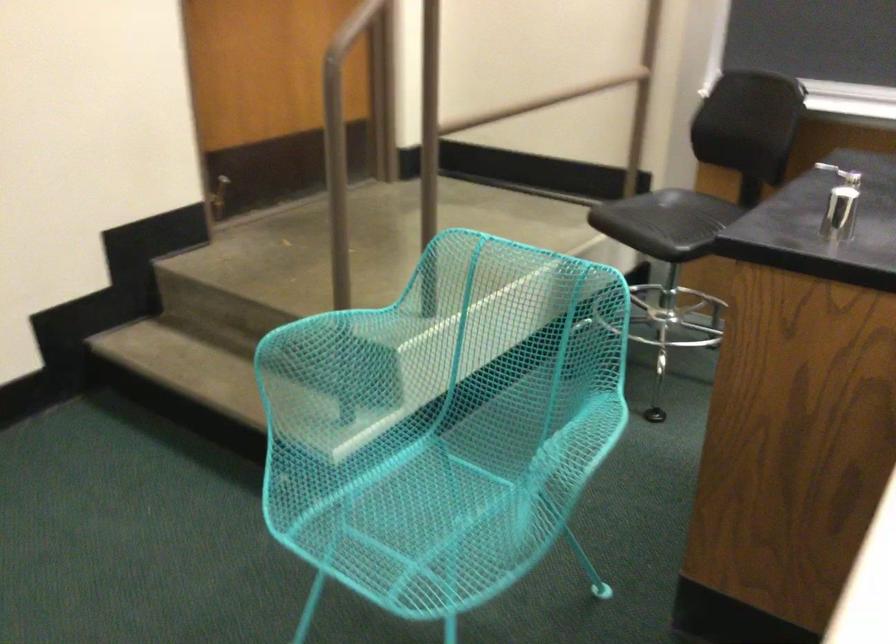
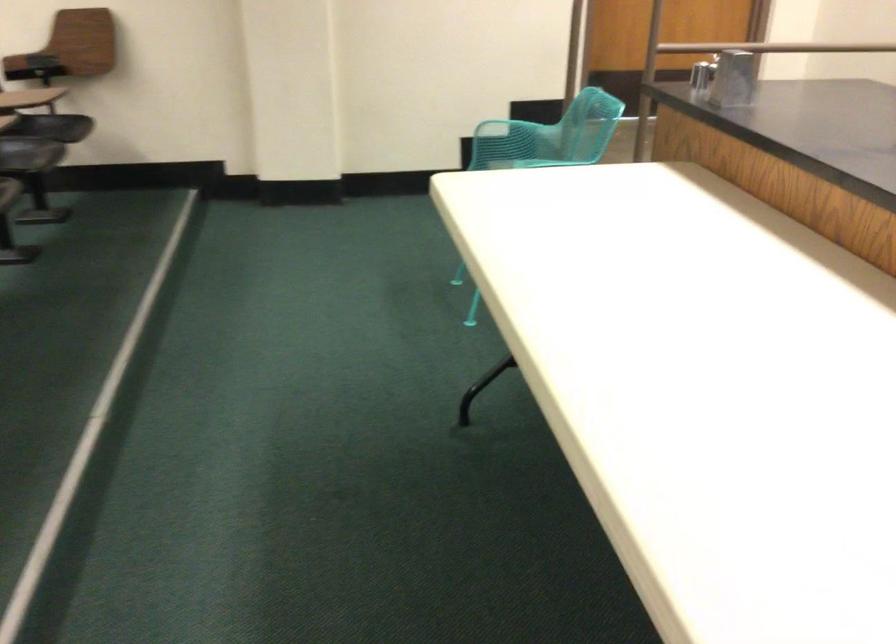
The point at [152,243] is marked in the first image. Where is the corresponding point in the second image?

(533, 111)